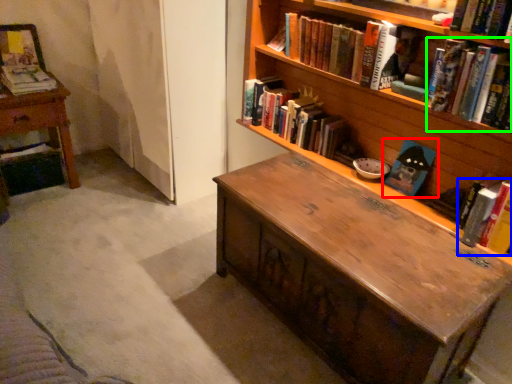
Question: Based on their relative distances, which object is farther from book (highlighted by a red box)? Choose from book (highlighted by a blue box) and book (highlighted by a green box).

Choices:
 (A) book
 (B) book

Answer: (B)